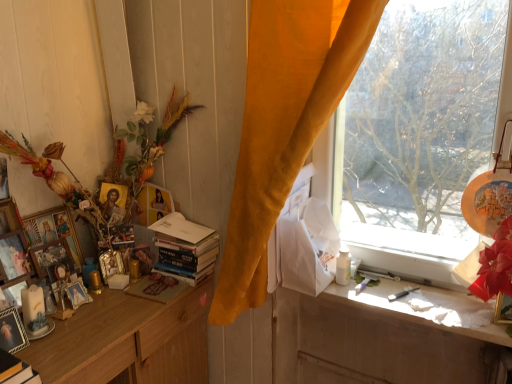
This screenshot has width=512, height=384. I want to click on vacant region under transparent glass window at right (from a real-world perspective), so click(x=388, y=276).